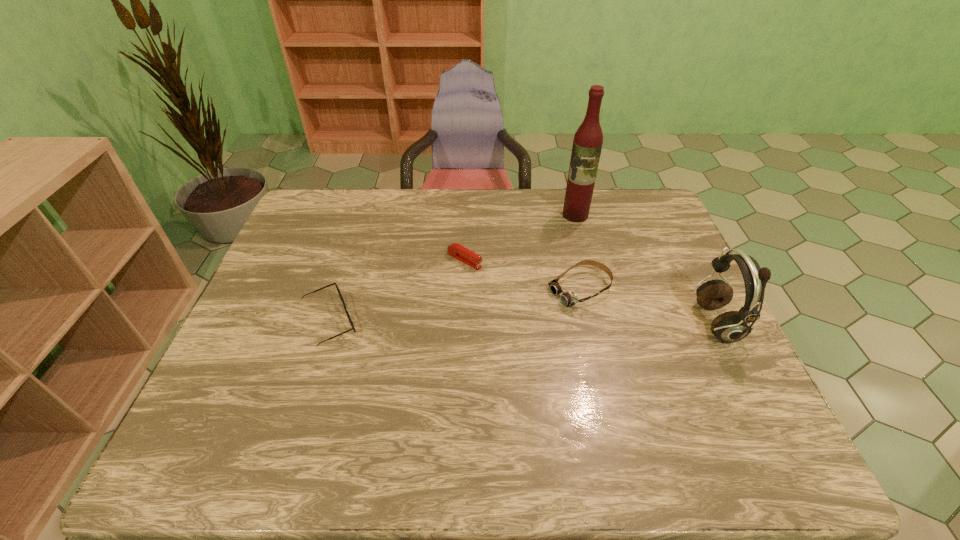
The width and height of the screenshot is (960, 540). I want to click on spectacles, so click(349, 318).

Where is `earphone`? This screenshot has height=540, width=960. earphone is located at coordinates (732, 326).

You are a GUI agent. You are given a task and a screenshot of the screen. Output one action in this format:
    pyautogui.click(x=<x>, y=<y>)
    Task: Click on the second tallest object
    The width and height of the screenshot is (960, 540).
    Given the screenshot: What is the action you would take?
    pyautogui.click(x=732, y=326)

This screenshot has height=540, width=960. I want to click on liquor, so click(587, 144).

The image size is (960, 540). I want to click on the tallest object, so click(x=587, y=144).

You are a GUI agent. You are given a task and a screenshot of the screen. Output one action in this format:
    pyautogui.click(x=<x>, y=<y>)
    Task: Click on the goggles
    The height and width of the screenshot is (540, 960).
    Given the screenshot: What is the action you would take?
    pos(568,299)

Where is `the fourth object from right to left`? the fourth object from right to left is located at coordinates [455, 250].

The height and width of the screenshot is (540, 960). I want to click on the shortest object, so click(455, 250).

Image resolution: width=960 pixels, height=540 pixels. In order to click on free space located with the lenses facing outward on the leftmost object in this screenshot , I will do `click(465, 322)`.

What are the coordinates of `blank space located on the label of the liquor` in the screenshot? It's located at (562, 266).